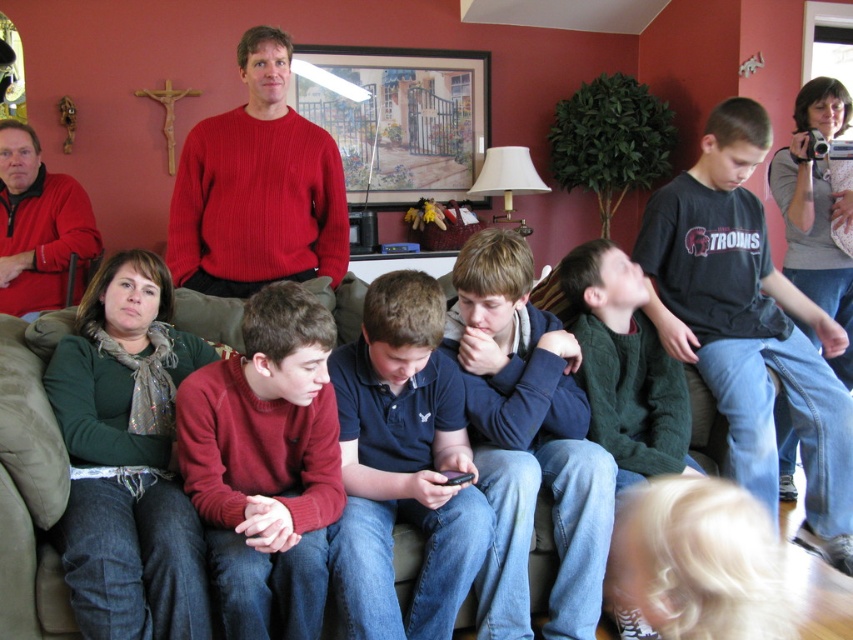
You are standing in the living room and want to move from point A to point B. Point A is at coordinate point (830,435) and point B is at coordinate point (242,365). Since you can only move forward, which direction should you face to reach point B from point A?

Since point (830,435) is further to the viewer than point (242,365), you should face towards the direction away from you to reach point B from point A.

You are a photographer who needs to capture a candid shot of the dark gray cotton shirt at center without being noticed. The camera you are using has a maximum focus range of 7 feet. Can you take the photo from your current position?

The dark gray cotton shirt at center and camera are 7.64 feet apart from each other. Since the camera can only focus up to 7 feet, you cannot take the photo from your current position because the distance exceeds the maximum focus range.

You are a painter who needs to hang a picture frame that is 2 meters tall. You have to choose between the wall above the ribbed red sweater at upper center and the wall above the brown fabric couch at lower center. Which wall space can accommodate the frame?

The ribbed red sweater at upper center is much taller than the brown fabric couch at lower center, so the wall above the ribbed red sweater at upper center has more vertical space and can accommodate the 2 meter tall picture frame.